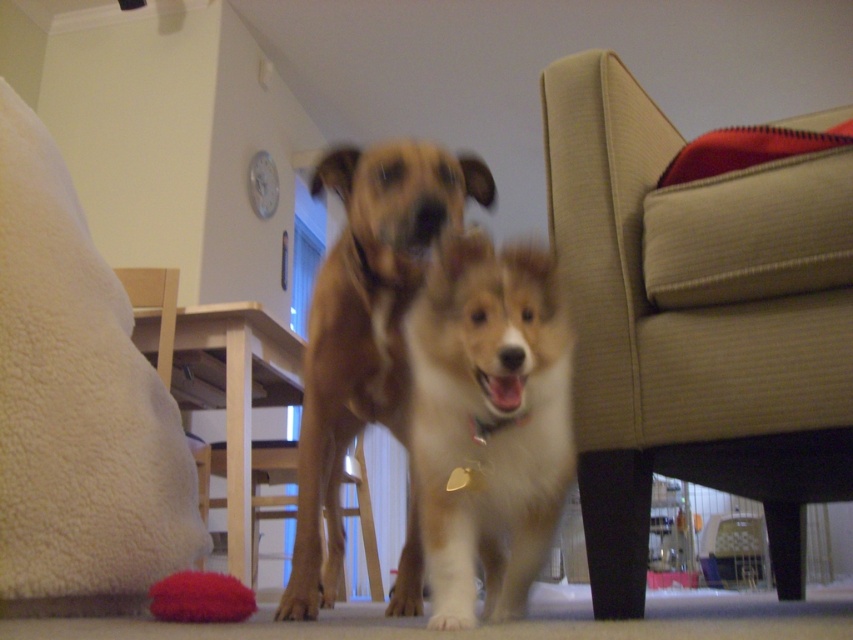
Which is behind, point (465, 454) or point (207, 595)?

The point (207, 595) is more distant.

Is point (524, 356) positioned behind point (178, 602)?

No.

Locate an element on the screen. Image resolution: width=853 pixels, height=640 pixels. fuzzy brown dog at center is located at coordinates (485, 428).

Between point (740, 259) and point (155, 608), which one is positioned in front?

Point (155, 608) is more forward.

Is beige fabric armchair at right positioned before fuzzy red ball at lower left?

That is False.

This screenshot has width=853, height=640. I want to click on beige fabric armchair at right, so click(695, 323).

Is fuzzy red ball at lower left below brown fur paw at center?

Actually, fuzzy red ball at lower left is above brown fur paw at center.

Is fuzzy red ball at lower left shorter than brown fur paw at center?

Indeed, fuzzy red ball at lower left has a lesser height compared to brown fur paw at center.

The width and height of the screenshot is (853, 640). What do you see at coordinates (200, 596) in the screenshot?
I see `fuzzy red ball at lower left` at bounding box center [200, 596].

This screenshot has height=640, width=853. In order to click on fuzzy red ball at lower left in this screenshot , I will do `click(200, 596)`.